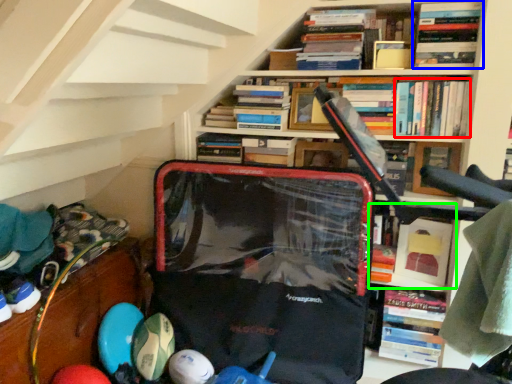
Question: Considering the real-world distances, which object is closest to book (highlighted by a red box)? book (highlighted by a blue box) or book (highlighted by a green box).

Choices:
 (A) book
 (B) book

Answer: (A)